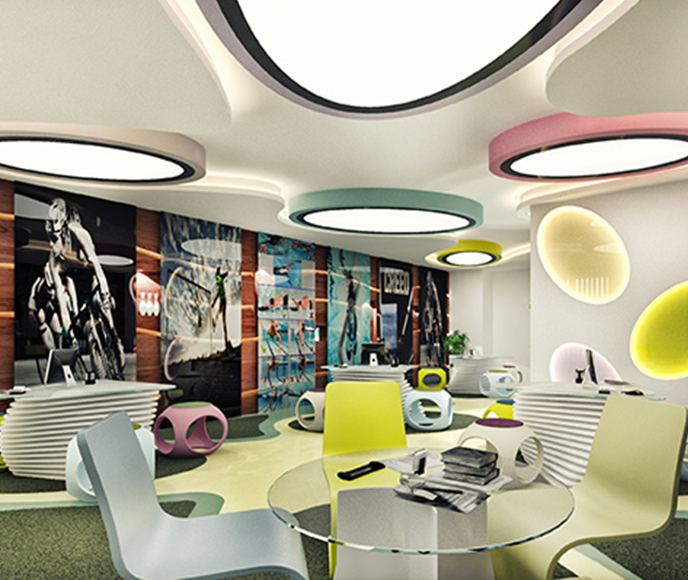
Find the location of `glass table`. glass table is located at coordinates (395, 516).